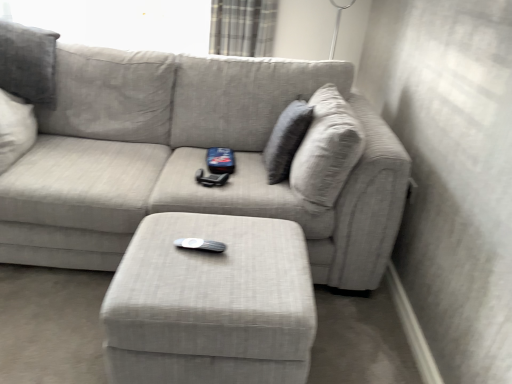
Question: Is plaid fabric curtain at upper center turned away from textured gray pillow at upper right?

Choices:
 (A) no
 (B) yes

Answer: (A)

Question: From the image's perspective, would you say plaid fabric curtain at upper center is shown under textured gray pillow at upper right?

Choices:
 (A) yes
 (B) no

Answer: (B)

Question: From a real-world perspective, is plaid fabric curtain at upper center positioned over textured gray pillow at upper right based on gravity?

Choices:
 (A) no
 (B) yes

Answer: (B)

Question: Can you confirm if plaid fabric curtain at upper center is wider than textured gray pillow at upper right?

Choices:
 (A) yes
 (B) no

Answer: (A)

Question: Can you confirm if plaid fabric curtain at upper center is positioned to the right of textured gray pillow at upper right?

Choices:
 (A) yes
 (B) no

Answer: (B)

Question: In the image, is matte gray ottoman at center positioned in front of or behind plaid fabric curtain at upper center?

Choices:
 (A) behind
 (B) front

Answer: (B)

Question: From the image's perspective, is matte gray ottoman at center located above or below plaid fabric curtain at upper center?

Choices:
 (A) above
 (B) below

Answer: (B)

Question: Would you say matte gray ottoman at center is to the left or to the right of plaid fabric curtain at upper center in the picture?

Choices:
 (A) left
 (B) right

Answer: (A)

Question: Is matte gray ottoman at center taller or shorter than plaid fabric curtain at upper center?

Choices:
 (A) tall
 (B) short

Answer: (A)

Question: From their relative heights in the image, would you say matte gray ottoman at center is taller or shorter than textured gray couch at center?

Choices:
 (A) short
 (B) tall

Answer: (A)

Question: Does point (310, 281) appear closer or farther from the camera than point (225, 195)?

Choices:
 (A) farther
 (B) closer

Answer: (B)

Question: Relative to textured gray couch at center, is matte gray ottoman at center in front or behind?

Choices:
 (A) front
 (B) behind

Answer: (A)

Question: Considering the positions of matte gray ottoman at center and textured gray couch at center in the image, is matte gray ottoman at center bigger or smaller than textured gray couch at center?

Choices:
 (A) small
 (B) big

Answer: (A)

Question: Considering the positions of matte gray ottoman at center and textured gray pillow at upper right in the image, is matte gray ottoman at center bigger or smaller than textured gray pillow at upper right?

Choices:
 (A) small
 (B) big

Answer: (B)

Question: Based on their positions, is matte gray ottoman at center located to the left or right of textured gray pillow at upper right?

Choices:
 (A) right
 (B) left

Answer: (B)